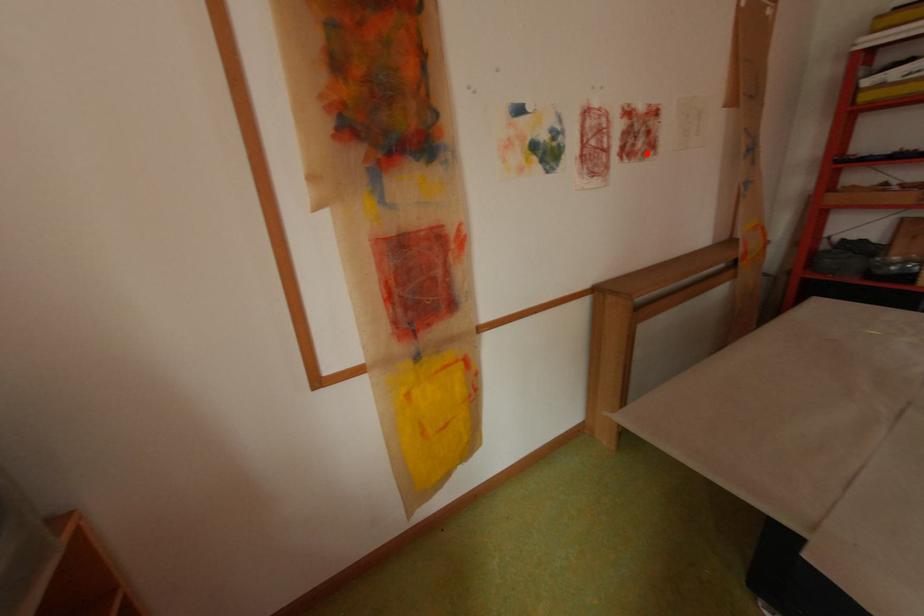
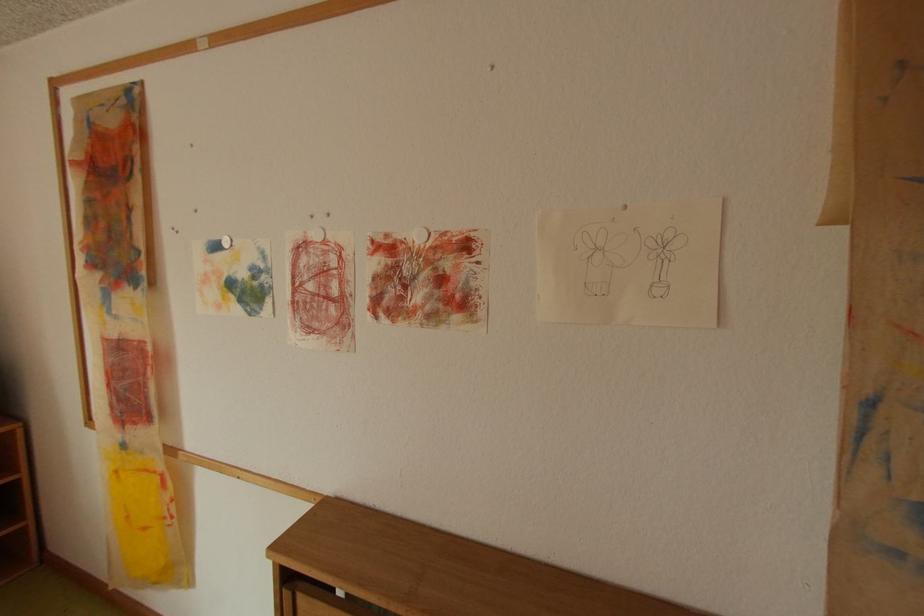
Find the pixel in the second image that matches the highlighted location in the first image.

(420, 313)